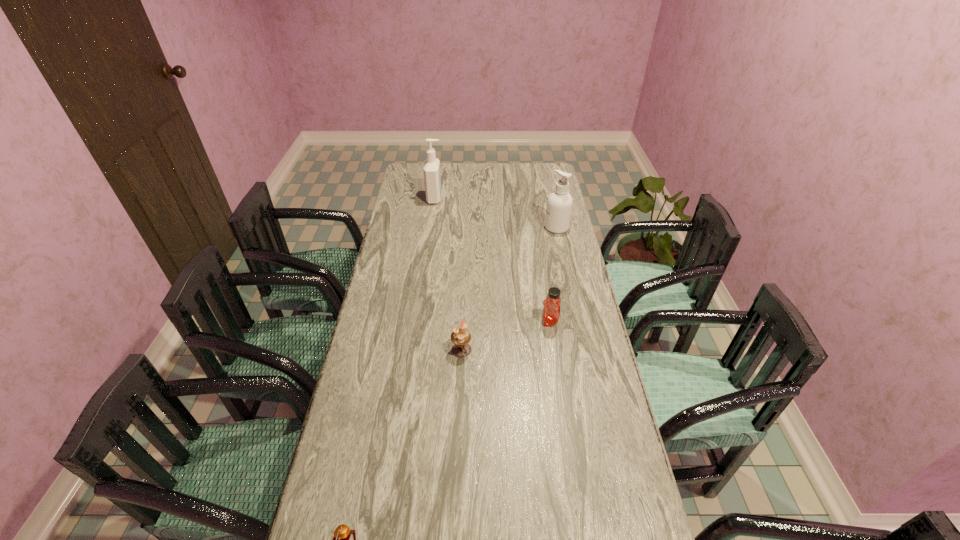
You are a GUI agent. You are given a task and a screenshot of the screen. Output one action in this format:
    pyautogui.click(x=<x>, y=<y>)
    Task: Click on the free space at the left edge
    
    Given the screenshot: What is the action you would take?
    pyautogui.click(x=404, y=346)

What are the coordinates of `vacant space at the right edge of the desktop` in the screenshot? It's located at (550, 193).

Where is `vacant space in between the right cleansing agent and the fourth object from left to right`? This screenshot has width=960, height=540. vacant space in between the right cleansing agent and the fourth object from left to right is located at coordinates (553, 274).

In order to click on empty location between the nearer cleansing agent and the second object from right to left in this screenshot , I will do `click(553, 274)`.

Locate an element on the screen. The width and height of the screenshot is (960, 540). free space between the fourth nearest object and the candle holder is located at coordinates (509, 288).

Find the location of `vacant area between the farthest object and the candle holder`. vacant area between the farthest object and the candle holder is located at coordinates coord(448,274).

Where is `free spot between the farthest object and the nearer cleansing agent`? Image resolution: width=960 pixels, height=540 pixels. free spot between the farthest object and the nearer cleansing agent is located at coordinates (495, 213).

Identify the location of object that is the nearest to the third nearest object. (461, 337).

Choose which object is the fourth nearest neighbor to the fourth object from right to left. Please provide its 2D coordinates. Your answer should be formatted as a tuple, i.e. [(x, y)], where the tuple contains the x and y coordinates of a point satisfying the conditions above.

[(344, 539)]

Identify the location of vacant area in the image that satisfies the following two spatial constraints: 1. on the front label of the candle holder; 2. on the left side of the fourth object from right to left. The height and width of the screenshot is (540, 960). (414, 349).